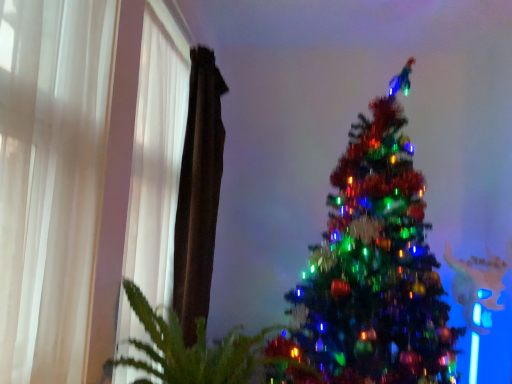
Question: Relative to white sheer curtain at left, arranged as the second curtain when viewed from the back, is white sheer curtain at left, which is counted as the 3th curtain, starting from the back, in front or behind?

Choices:
 (A) behind
 (B) front

Answer: (B)

Question: Considering the positions of white sheer curtain at left, which is counted as the 3th curtain, starting from the back, and white sheer curtain at left, arranged as the second curtain when viewed from the back, in the image, is white sheer curtain at left, which is counted as the 3th curtain, starting from the back, bigger or smaller than white sheer curtain at left, arranged as the second curtain when viewed from the back,?

Choices:
 (A) small
 (B) big

Answer: (A)

Question: Which of these objects is positioned closest to the green leafy plant at lower left?

Choices:
 (A) white sheer curtain at left, marked as the 2th curtain in a front-to-back arrangement
 (B) shiny green christmas tree at center
 (C) brown fabric curtain at left, the third curtain in the front-to-back sequence
 (D) white sheer curtain at left, which is the first curtain from front to back

Answer: (A)

Question: Considering the real-world distances, which object is closest to the white sheer curtain at left, marked as the 2th curtain in a front-to-back arrangement?

Choices:
 (A) white sheer curtain at left, which is counted as the 3th curtain, starting from the back
 (B) green leafy plant at lower left
 (C) shiny green christmas tree at center
 (D) brown fabric curtain at left, the first curtain viewed from the back

Answer: (D)